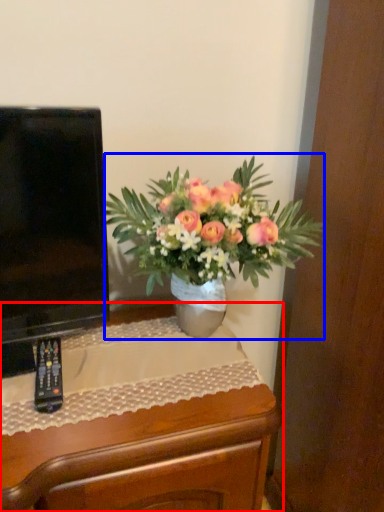
Question: Which object appears closest to the camera in this image, desk (highlighted by a red box) or houseplant (highlighted by a blue box)?

Choices:
 (A) desk
 (B) houseplant

Answer: (B)